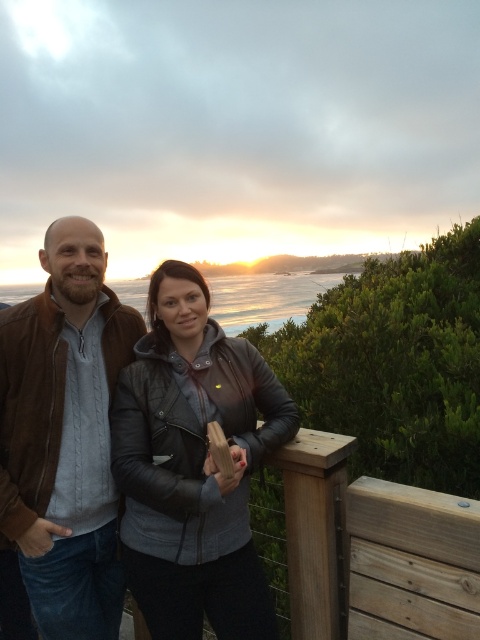
Question: Which object is closer to the camera taking this photo?

Choices:
 (A) leather jacket at center
 (B) brown leather jacket at left
 (C) blue ocean at center

Answer: (A)

Question: Can you confirm if leather jacket at center is thinner than brown leather jacket at left?

Choices:
 (A) no
 (B) yes

Answer: (A)

Question: Is brown leather jacket at left behind blue ocean at center?

Choices:
 (A) yes
 (B) no

Answer: (B)

Question: Which of the following is the farthest from the observer?

Choices:
 (A) (296, 294)
 (B) (29, 320)
 (C) (223, 349)

Answer: (A)

Question: Does brown leather jacket at left appear on the right side of blue ocean at center?

Choices:
 (A) yes
 (B) no

Answer: (A)

Question: Which point is farther from the camera taking this photo?

Choices:
 (A) (190, 557)
 (B) (231, 284)

Answer: (B)